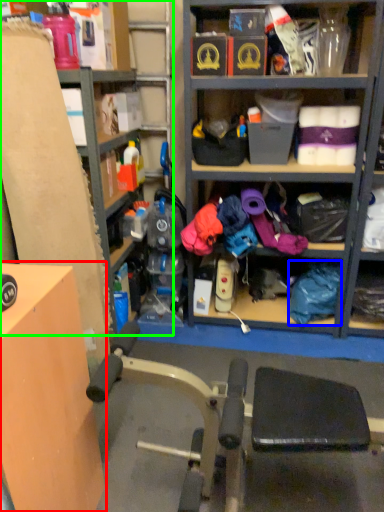
Question: Based on their relative distances, which object is nearer to table (highlighted by a red box)? Choose from clothing (highlighted by a blue box) and shelf (highlighted by a green box).

Choices:
 (A) clothing
 (B) shelf

Answer: (B)